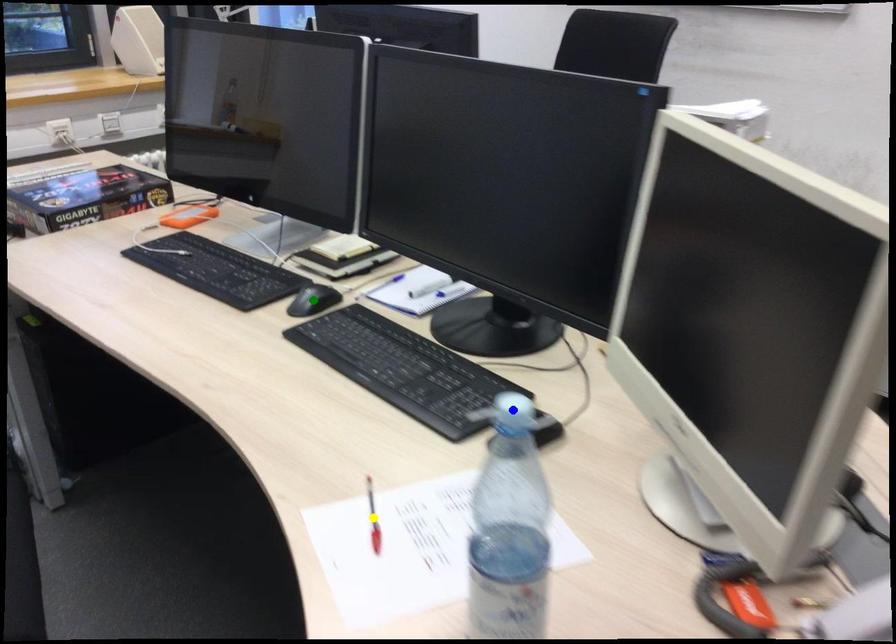
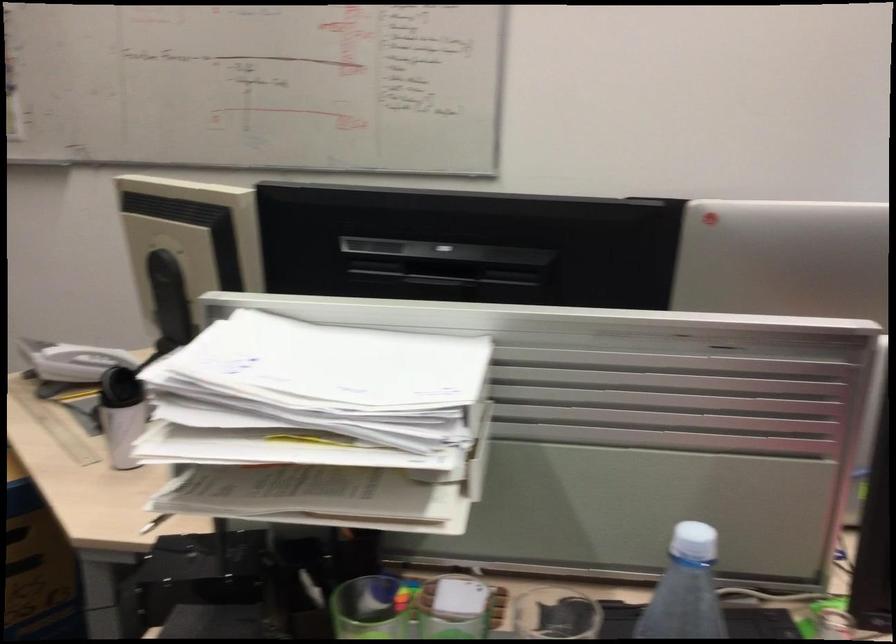
I am providing you with two images of the same scene from different viewpoints. Three points are marked in image1. Which point corresponds to a part or object that is occluded in image2?In image1, three points are marked. Which of them correspond to a part or object that is occluded in image2?Among the three points shown in image1, which one corresponds to a part or object that is no longer visible due to occlusion in image2?

green point, yellow point, blue point